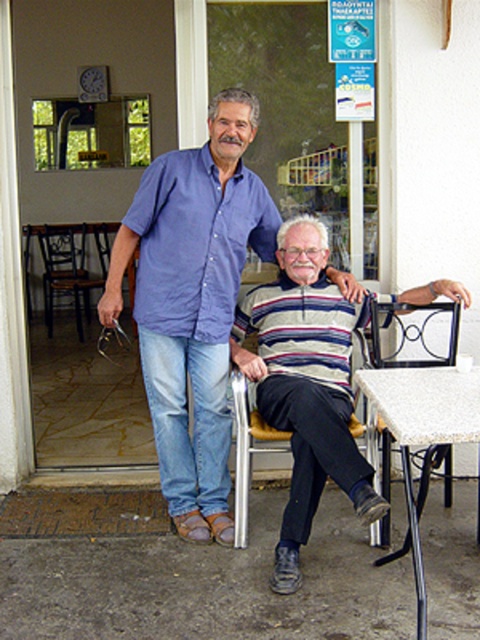
Question: Where is blue cotton shirt at center located in relation to striped knitwear at center in the image?

Choices:
 (A) above
 (B) below

Answer: (A)

Question: Which of the following is the farthest from the observer?

Choices:
 (A) (441, 419)
 (B) (432, 307)
 (C) (182, 154)

Answer: (B)

Question: Can you confirm if matte blue shirt at center is positioned to the right of wooden chair at left?

Choices:
 (A) yes
 (B) no

Answer: (A)

Question: Can you confirm if metallic frame chair at lower right is positioned above wooden chair at left?

Choices:
 (A) no
 (B) yes

Answer: (A)

Question: Estimate the real-world distances between objects in this image. Which object is closer to the matte blue shirt at center?

Choices:
 (A) striped knitwear at center
 (B) wooden chair at left
 (C) white laminate table at lower right

Answer: (A)

Question: Based on their relative distances, which object is farther from the matte blue shirt at center?

Choices:
 (A) wooden chair at left
 (B) striped knitwear at center
 (C) white laminate table at lower right

Answer: (A)